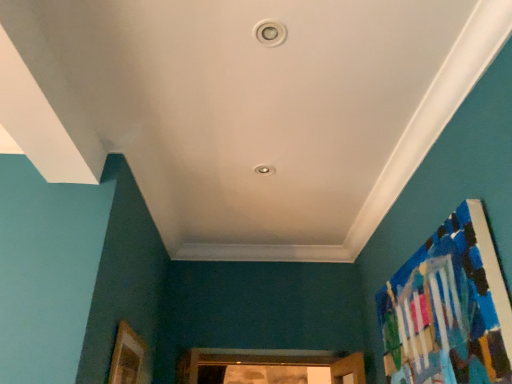
Describe the element at coordinates (128, 358) in the screenshot. This screenshot has width=512, height=384. I see `wooden picture frame at lower left` at that location.

Image resolution: width=512 pixels, height=384 pixels. I want to click on wooden picture frame at lower left, so click(128, 358).

Measure the distance between point (x=473, y=254) and camera.

Point (x=473, y=254) and camera are 1.26 meters apart.

Describe the element at coordinates (449, 308) in the screenshot. Image resolution: width=512 pixels, height=384 pixels. I see `painted wood bulletin board at right` at that location.

Image resolution: width=512 pixels, height=384 pixels. In order to click on painted wood bulletin board at right in this screenshot , I will do `click(449, 308)`.

At what (x,y) coordinates should I click in order to perform the action: click on wooden picture frame at lower left. Please return your answer as a coordinate pair (x, y). This screenshot has width=512, height=384. Looking at the image, I should click on (128, 358).

Between wooden picture frame at lower left and painted wood bulletin board at right, which one appears on the left side from the viewer's perspective?

From the viewer's perspective, wooden picture frame at lower left appears more on the left side.

Does wooden picture frame at lower left come behind painted wood bulletin board at right?

Yes, wooden picture frame at lower left is behind painted wood bulletin board at right.

Which is behind, point (127, 371) or point (463, 340)?

The point (127, 371) is behind.

From the image's perspective, which object appears higher, wooden picture frame at lower left or painted wood bulletin board at right?

From the image's view, painted wood bulletin board at right is above.

From a real-world perspective, relative to painted wood bulletin board at right, is wooden picture frame at lower left vertically above or below?

In terms of real-world spatial position, wooden picture frame at lower left is below painted wood bulletin board at right.

Which of these two, wooden picture frame at lower left or painted wood bulletin board at right, is wider?

painted wood bulletin board at right is wider.

Based on the photo, considering the relative sizes of wooden picture frame at lower left and painted wood bulletin board at right in the image provided, is wooden picture frame at lower left shorter than painted wood bulletin board at right?

Yes.

Who is smaller, wooden picture frame at lower left or painted wood bulletin board at right?

wooden picture frame at lower left.

Based on the photo, is wooden picture frame at lower left inside the boundaries of painted wood bulletin board at right, or outside?

wooden picture frame at lower left exists outside the volume of painted wood bulletin board at right.

Is wooden picture frame at lower left next to painted wood bulletin board at right?

No, wooden picture frame at lower left is not next to painted wood bulletin board at right.

Is wooden picture frame at lower left looking in the opposite direction of painted wood bulletin board at right?

No, wooden picture frame at lower left is not facing the opposite direction of painted wood bulletin board at right.

Where is `bulletin board above the wooden picture frame at lower left (from a real-world perspective)`? The height and width of the screenshot is (384, 512). bulletin board above the wooden picture frame at lower left (from a real-world perspective) is located at coordinates (449, 308).

In the image, is painted wood bulletin board at right on the left side or the right side of wooden picture frame at lower left?

From the image, it's evident that painted wood bulletin board at right is to the right of wooden picture frame at lower left.

Is painted wood bulletin board at right positioned in front of wooden picture frame at lower left?

Yes, it is.

Between point (475, 282) and point (136, 357), which one is positioned in front?

Point (475, 282)

Consider the image. From the image's perspective, between painted wood bulletin board at right and wooden picture frame at lower left, who is located below?

wooden picture frame at lower left appears lower in the image.

From a real-world perspective, which object stands above the other?

painted wood bulletin board at right.

Which object is wider, painted wood bulletin board at right or wooden picture frame at lower left?

Wider between the two is painted wood bulletin board at right.

Considering the relative sizes of painted wood bulletin board at right and wooden picture frame at lower left in the image provided, is painted wood bulletin board at right taller than wooden picture frame at lower left?

Yes.

Does painted wood bulletin board at right have a larger size compared to wooden picture frame at lower left?

Correct, painted wood bulletin board at right is larger in size than wooden picture frame at lower left.

Is painted wood bulletin board at right spatially inside wooden picture frame at lower left, or outside of it?

painted wood bulletin board at right exists outside the volume of wooden picture frame at lower left.

Is painted wood bulletin board at right not close to wooden picture frame at lower left?

Yes.

Is painted wood bulletin board at right oriented away from wooden picture frame at lower left?

painted wood bulletin board at right does not have its back to wooden picture frame at lower left.

Can you tell me how much painted wood bulletin board at right and wooden picture frame at lower left differ in facing direction?

painted wood bulletin board at right and wooden picture frame at lower left are facing 179 degrees away from each other.

How distant is painted wood bulletin board at right from wooden picture frame at lower left?

painted wood bulletin board at right is 4.19 feet from wooden picture frame at lower left.

Locate an element on the screen. This screenshot has width=512, height=384. picture frame located behind the painted wood bulletin board at right is located at coordinates (128, 358).

You are a GUI agent. You are given a task and a screenshot of the screen. Output one action in this format:
    pyautogui.click(x=<x>, y=<y>)
    Task: Click on the picture frame below the painted wood bulletin board at right (from the image's perspective)
    
    Given the screenshot: What is the action you would take?
    pyautogui.click(x=128, y=358)

Find the location of a particular element. bulletin board that appears in front of the wooden picture frame at lower left is located at coordinates (449, 308).